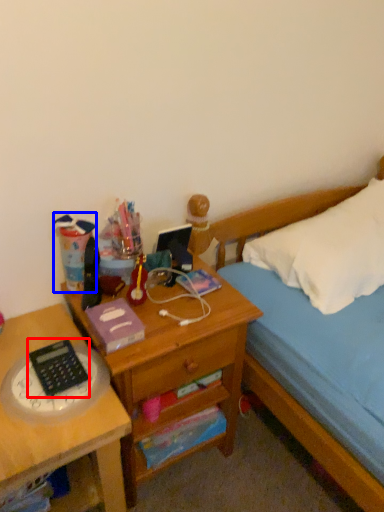
Question: Which point is further to the camera, calculator (highlighted by a red box) or stationery (highlighted by a blue box)?

Choices:
 (A) calculator
 (B) stationery

Answer: (B)